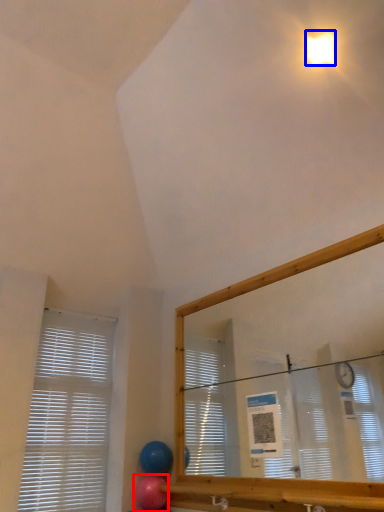
Question: Among these objects, which one is farthest to the camera, balloon (highlighted by a red box) or light (highlighted by a blue box)?

Choices:
 (A) balloon
 (B) light

Answer: (A)